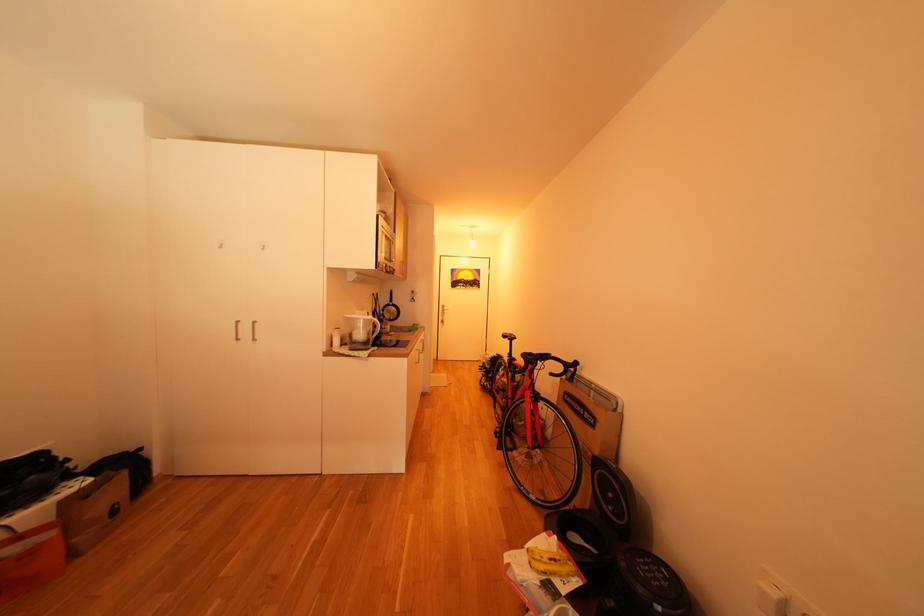
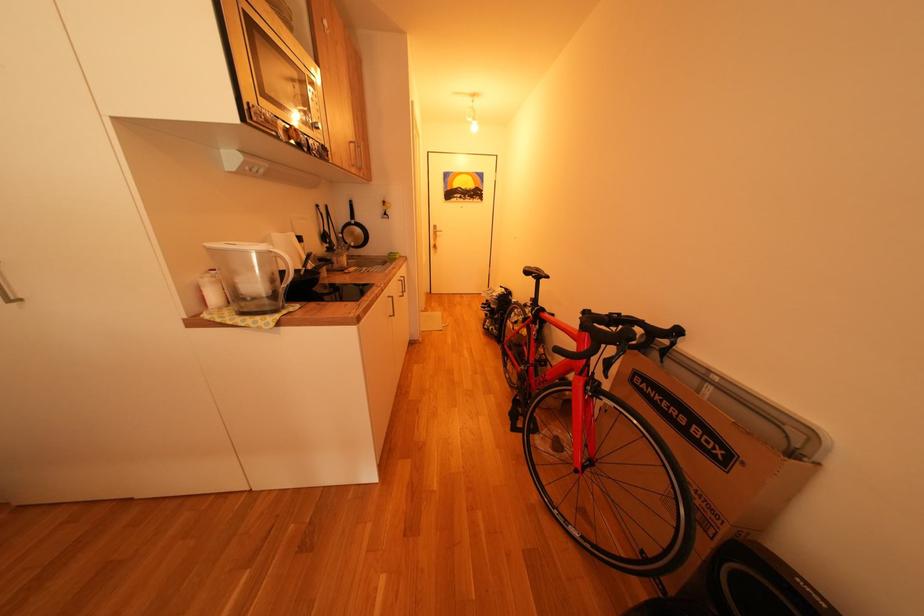
Question: How did the camera likely rotate?

Choices:
 (A) Left
 (B) Right
 (C) Up
 (D) Down

Answer: (D)